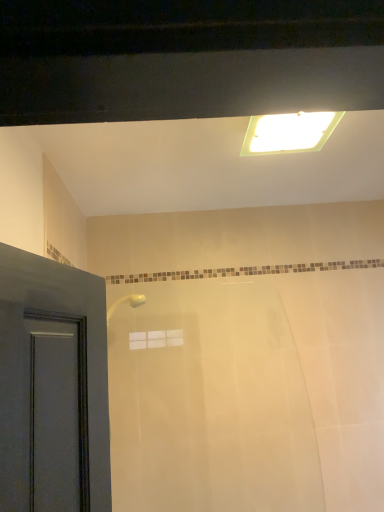
Question: Is translucent plastic bathtub at center located within white fluorescent light at upper center?

Choices:
 (A) no
 (B) yes

Answer: (A)

Question: Is white fluorescent light at upper center positioned with its back to translucent plastic bathtub at center?

Choices:
 (A) no
 (B) yes

Answer: (A)

Question: Is white fluorescent light at upper center positioned before translucent plastic bathtub at center?

Choices:
 (A) yes
 (B) no

Answer: (A)

Question: Considering the relative sizes of white fluorescent light at upper center and translucent plastic bathtub at center in the image provided, is white fluorescent light at upper center shorter than translucent plastic bathtub at center?

Choices:
 (A) no
 (B) yes

Answer: (B)

Question: Is white fluorescent light at upper center placed right next to translucent plastic bathtub at center?

Choices:
 (A) no
 (B) yes

Answer: (A)

Question: Does white fluorescent light at upper center have a smaller size compared to translucent plastic bathtub at center?

Choices:
 (A) no
 (B) yes

Answer: (B)

Question: Is translucent plastic bathtub at center turned away from white fluorescent light at upper center?

Choices:
 (A) yes
 (B) no

Answer: (B)

Question: Can you confirm if translucent plastic bathtub at center is shorter than white fluorescent light at upper center?

Choices:
 (A) yes
 (B) no

Answer: (B)

Question: Does translucent plastic bathtub at center appear on the right side of white fluorescent light at upper center?

Choices:
 (A) yes
 (B) no

Answer: (B)

Question: From the image's perspective, is translucent plastic bathtub at center below white fluorescent light at upper center?

Choices:
 (A) yes
 (B) no

Answer: (A)

Question: From a real-world perspective, is translucent plastic bathtub at center physically above white fluorescent light at upper center?

Choices:
 (A) no
 (B) yes

Answer: (A)

Question: From the image's perspective, would you say translucent plastic bathtub at center is positioned over white fluorescent light at upper center?

Choices:
 (A) yes
 (B) no

Answer: (B)

Question: Is point (259, 147) closer or farther from the camera than point (324, 340)?

Choices:
 (A) closer
 (B) farther

Answer: (A)